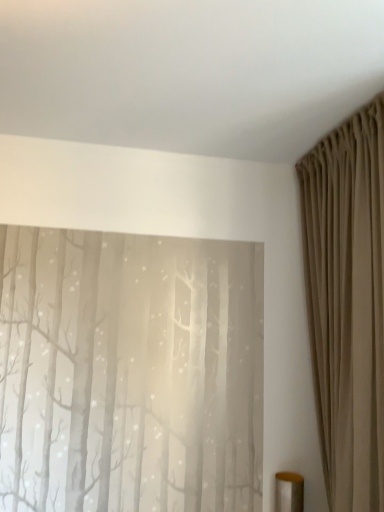
Question: Considering the positions of point (354, 477) and point (281, 488), is point (354, 477) closer or farther from the camera than point (281, 488)?

Choices:
 (A) closer
 (B) farther

Answer: (A)

Question: Considering the relative positions of beige fabric curtain at right and metallic gold cylinder at lower right in the image provided, is beige fabric curtain at right to the left or to the right of metallic gold cylinder at lower right?

Choices:
 (A) right
 (B) left

Answer: (A)

Question: In terms of width, does beige fabric curtain at right look wider or thinner when compared to metallic gold cylinder at lower right?

Choices:
 (A) wide
 (B) thin

Answer: (A)

Question: Does point (279, 472) appear closer or farther from the camera than point (375, 351)?

Choices:
 (A) closer
 (B) farther

Answer: (B)

Question: In the image, is metallic gold cylinder at lower right positioned in front of or behind beige fabric curtain at right?

Choices:
 (A) front
 (B) behind

Answer: (B)

Question: From their relative heights in the image, would you say metallic gold cylinder at lower right is taller or shorter than beige fabric curtain at right?

Choices:
 (A) short
 (B) tall

Answer: (A)

Question: Looking at their shapes, would you say metallic gold cylinder at lower right is wider or thinner than beige fabric curtain at right?

Choices:
 (A) thin
 (B) wide

Answer: (A)